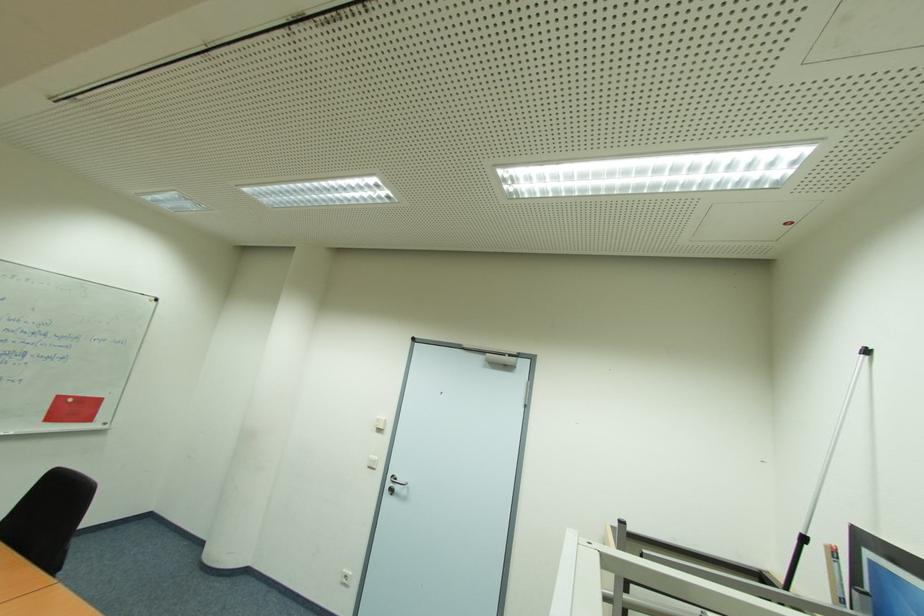
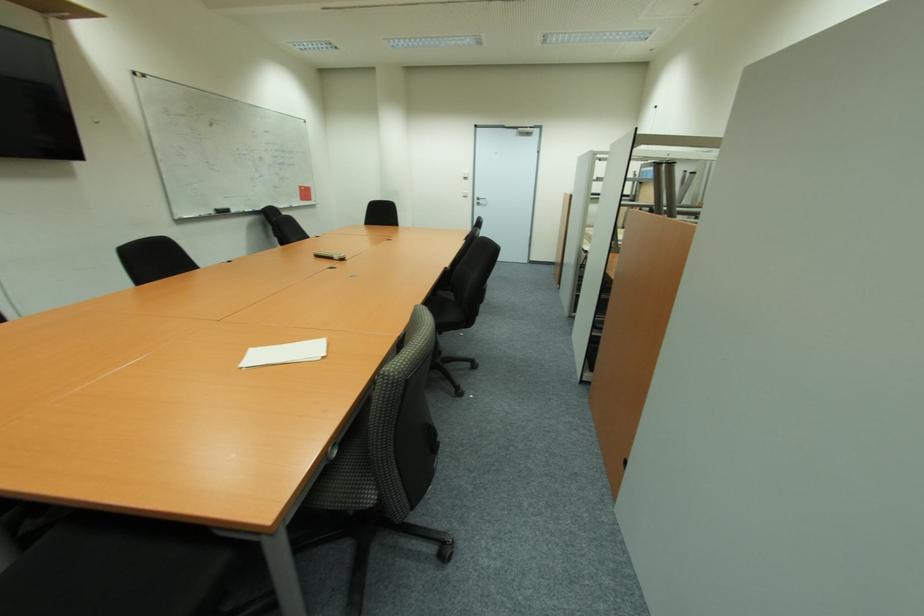
Where in the second image is the point corresponding to pixel 399 488 from the first image?

(483, 203)